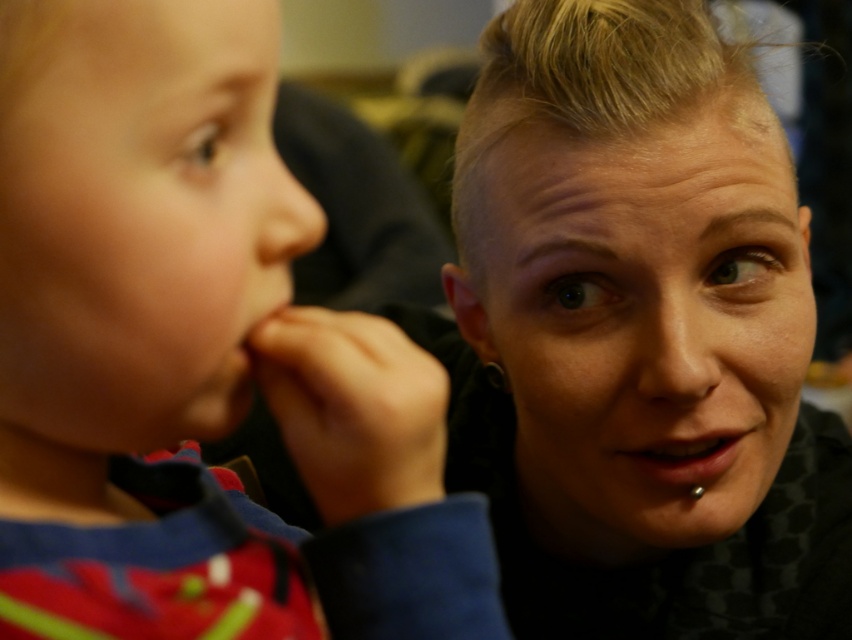
Can you confirm if smooth skin baby at left is wider than smooth flesh mouth at center?

Correct, the width of smooth skin baby at left exceeds that of smooth flesh mouth at center.

Between smooth skin baby at left and smooth flesh mouth at center, which one appears on the right side from the viewer's perspective?

smooth flesh mouth at center is more to the right.

Where is `smooth skin baby at left`? Image resolution: width=852 pixels, height=640 pixels. smooth skin baby at left is located at coordinates (137, 216).

You are a GUI agent. You are given a task and a screenshot of the screen. Output one action in this format:
    pyautogui.click(x=<x>, y=<y>)
    Task: Click on the smooth skin baby at left
    The width and height of the screenshot is (852, 640).
    Given the screenshot: What is the action you would take?
    pyautogui.click(x=137, y=216)

Does matte red shirt at left appear over smooth skin baby at left?

Incorrect, matte red shirt at left is not positioned above smooth skin baby at left.

Which is in front, point (225, 564) or point (99, 26)?

Point (99, 26) is more forward.

I want to click on matte red shirt at left, so click(x=196, y=356).

Is smooth skin face at right to the right of smooth flesh mouth at center from the viewer's perspective?

No, smooth skin face at right is not to the right of smooth flesh mouth at center.

Between smooth skin face at right and smooth flesh mouth at center, which one is positioned higher?

smooth skin face at right is above.

What are the coordinates of `smooth skin face at right` in the screenshot? It's located at (642, 321).

Locate an element on the screen. The image size is (852, 640). smooth skin face at right is located at coordinates (642, 321).